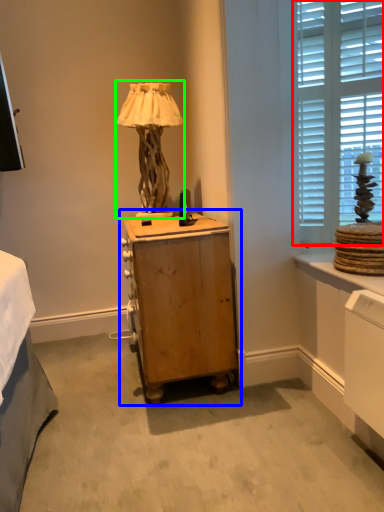
Question: Which is farther away from window (highlighted by a red box)? nightstand (highlighted by a blue box) or table lamp (highlighted by a green box)?

Choices:
 (A) nightstand
 (B) table lamp

Answer: (B)